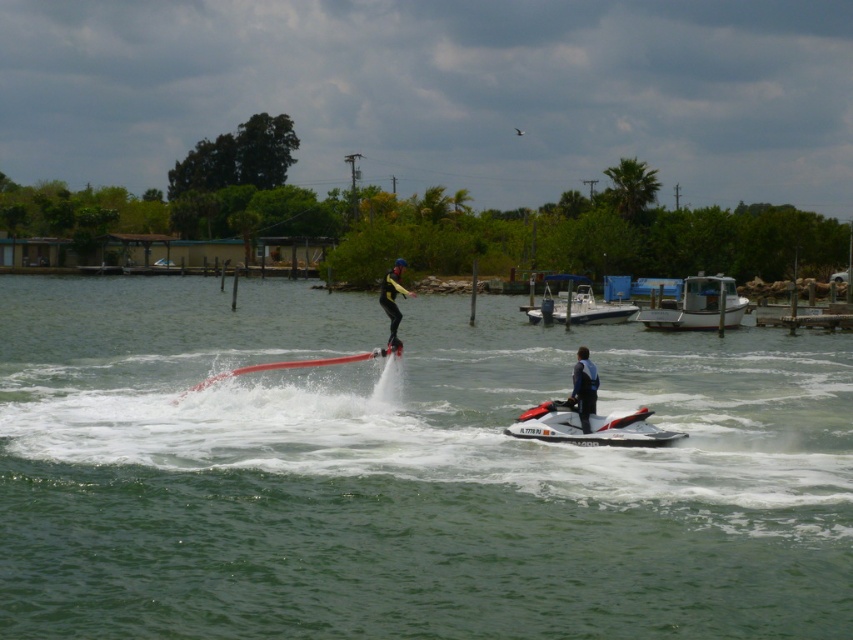
Is white matte jet ski at center positioned behind white plastic boat at right?

No.

Does point (614, 440) come farther from viewer compared to point (555, 308)?

No, it is not.

Locate an element on the screen. Image resolution: width=853 pixels, height=640 pixels. white matte jet ski at center is located at coordinates (589, 426).

Which of these two, clear water at center or dark blue wetsuit at center, stands taller?

With more height is clear water at center.

This screenshot has width=853, height=640. I want to click on clear water at center, so click(x=405, y=474).

Does clear water at center have a larger size compared to white matte boat at right?

Yes, clear water at center is bigger than white matte boat at right.

Looking at this image, who is taller, clear water at center or white matte boat at right?

clear water at center is taller.

Between point (695, 458) and point (701, 326), which one is positioned in front?

Positioned in front is point (695, 458).

Find the location of `clear water at center`. clear water at center is located at coordinates (405, 474).